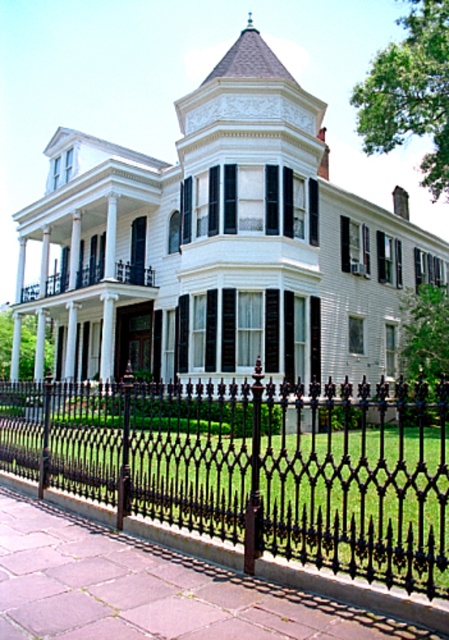
You are standing at the front entrance of the Victorian house and want to place two garden statues. The first statue is at point [61,212] and the second at point [126,266]. Which statue is closer to the house?

Point [126,266] is closer to the house because point [61,212] is behind it, meaning it is further away from the house.

In the scene shown: You are standing at the point marked as point [255,465] in the image. What object is located at that point?

The black wrought iron fence at lower center is located at point [255,465].

You are a delivery person approaching the house and need to determine the best path to the front door. Considering the black wrought iron fence at lower center and the white painted wood porch at center, which one is taller and might block your view of the front door?

→ The black wrought iron fence at lower center is taller than the white painted wood porch at center, so it might block your view of the front door.